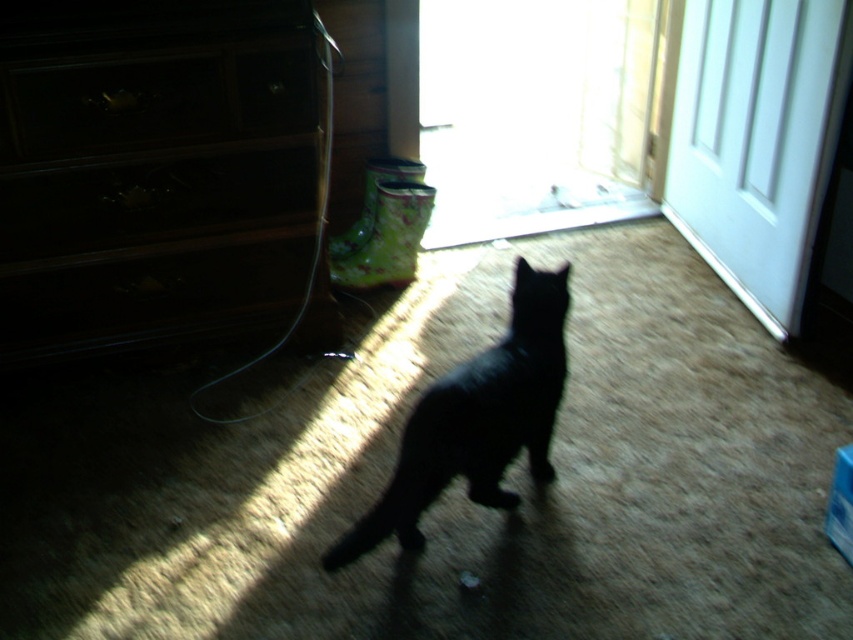
Can you confirm if dark wood dresser at left is positioned to the left of white glossy door at upper right?

Indeed, dark wood dresser at left is positioned on the left side of white glossy door at upper right.

Between dark wood dresser at left and white glossy door at upper right, which one is positioned lower?

dark wood dresser at left

Between point (9, 144) and point (837, 74), which one is positioned behind?

The point (837, 74) is behind.

Where is `dark wood dresser at left`? dark wood dresser at left is located at coordinates (155, 170).

Is point (701, 200) farther from viewer compared to point (49, 177)?

Yes, it is.

Can you confirm if white glossy door at upper right is shorter than wooden drawer at left?

No.

Where is `white glossy door at upper right`? The width and height of the screenshot is (853, 640). white glossy door at upper right is located at coordinates (756, 140).

Does point (248, 8) come closer to viewer compared to point (520, 266)?

No, (248, 8) is behind (520, 266).

Is dark wood dresser at left below black matte cat at center?

No.

Which is behind, point (135, 10) or point (410, 496)?

The point (135, 10) is more distant.

The image size is (853, 640). I want to click on dark wood dresser at left, so click(x=155, y=170).